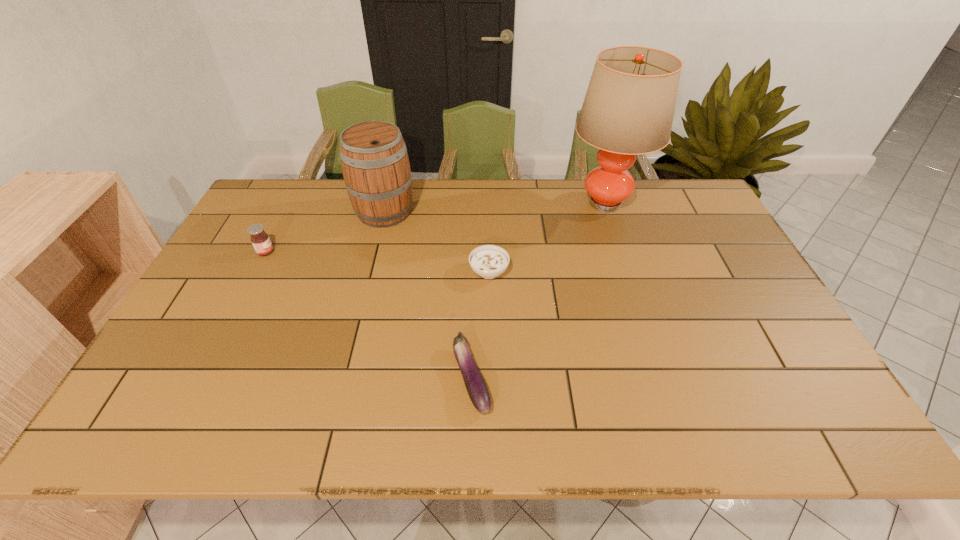
At what (x,y) coordinates should I click in order to perform the action: click on vacant space located 0.370m on the label side of the third farthest object. Please return your answer as a coordinate pair (x, y). Looking at the image, I should click on (397, 252).

The width and height of the screenshot is (960, 540). Identify the location of free space located on the back of the second nearest object. (488, 233).

The height and width of the screenshot is (540, 960). What are the coordinates of `vacant area situated on the left of the nearest object` in the screenshot? It's located at (370, 378).

Where is `lamp that is at the far edge`? This screenshot has width=960, height=540. lamp that is at the far edge is located at coordinates (628, 110).

At what (x,y) coordinates should I click in order to perform the action: click on cider situated at the far edge. Please return your answer as a coordinate pair (x, y). The height and width of the screenshot is (540, 960). Looking at the image, I should click on (375, 164).

Locate an element on the screen. The image size is (960, 540). object positioned at the near edge is located at coordinates (475, 384).

At what (x,y) coordinates should I click in order to perform the action: click on object situated at the left edge. Please return your answer as a coordinate pair (x, y). This screenshot has height=540, width=960. Looking at the image, I should click on (260, 240).

At what (x,y) coordinates should I click in order to perform the action: click on vacant area at the far edge of the desktop. Please return your answer as a coordinate pair (x, y). The image size is (960, 540). Looking at the image, I should click on (530, 201).

This screenshot has height=540, width=960. Identify the location of free space at the near edge. (238, 408).

Locate an element on the screen. The width and height of the screenshot is (960, 540). vacant space at the left edge of the desktop is located at coordinates (200, 339).